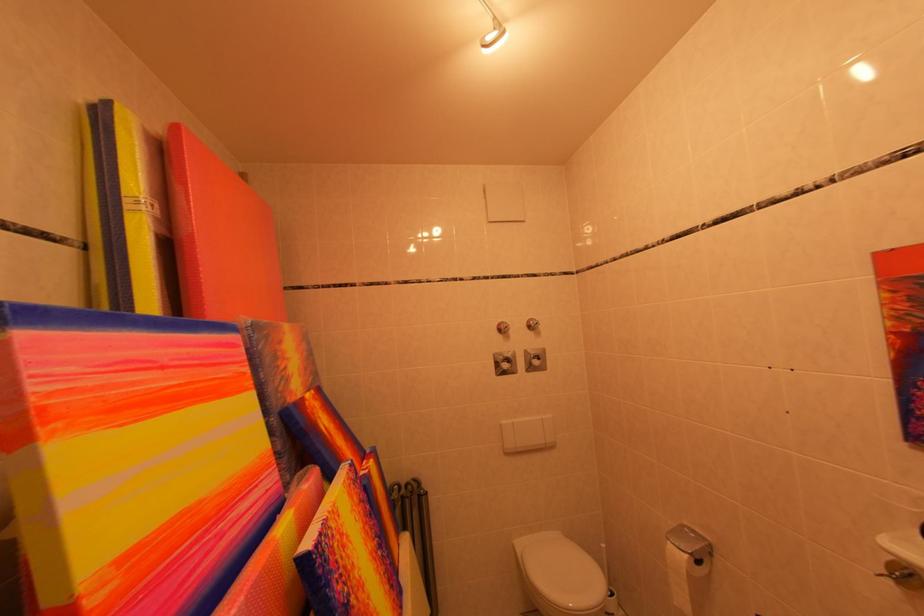
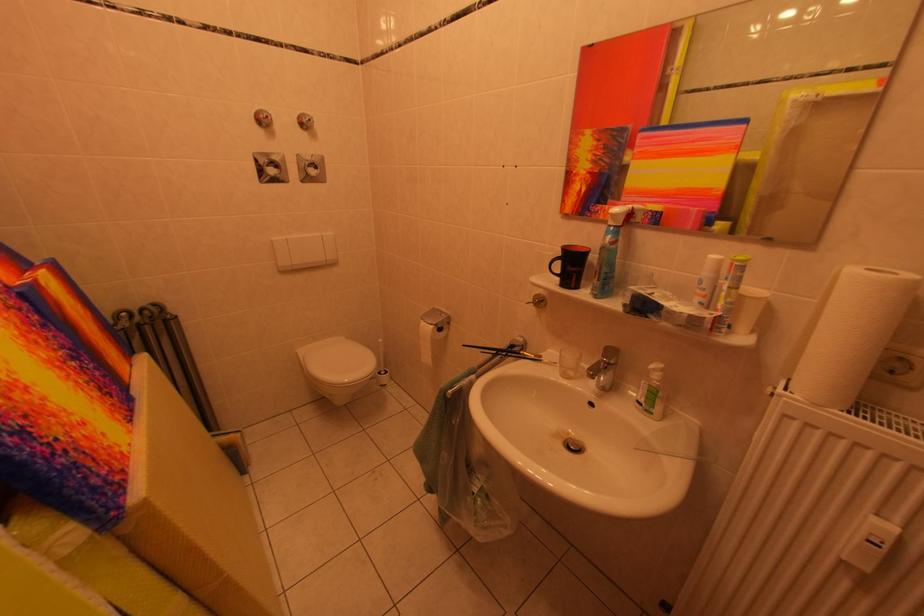
First-person continuous shooting, in which direction is the camera rotating?

The camera's rotation is toward right-down.